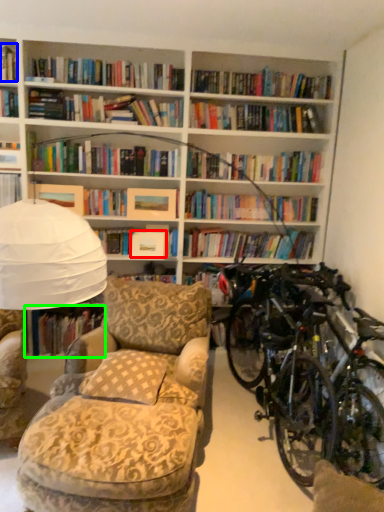
Question: Which is farther away from paperback book (highlighted by a red box)? book (highlighted by a blue box) or book (highlighted by a green box)?

Choices:
 (A) book
 (B) book

Answer: (A)